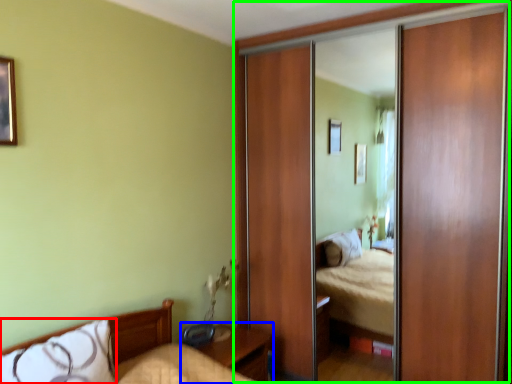
Question: Which is nearer to the pillow (highlighted by a red box)? nightstand (highlighted by a blue box) or glass door (highlighted by a green box).

Choices:
 (A) nightstand
 (B) glass door

Answer: (A)